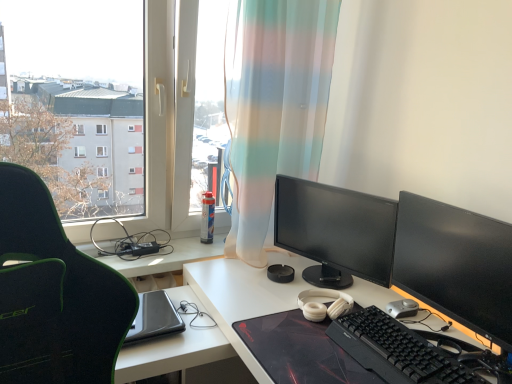
Measure the distance between black plastic keyboard at lower right and camera.

black plastic keyboard at lower right is 98.60 centimeters away from camera.

The width and height of the screenshot is (512, 384). Describe the element at coordinates (94, 103) in the screenshot. I see `transparent plastic window at upper left` at that location.

What is the approximate height of transparent plastic window at upper left?

34.05 inches.

What do you see at coordinates (243, 296) in the screenshot?
I see `white matte desk at center` at bounding box center [243, 296].

In order to click on matte black monitor at center, positioned as the 2th computer monitor in front-to-back order in this screenshot , I will do `click(336, 227)`.

This screenshot has width=512, height=384. Describe the element at coordinates (336, 227) in the screenshot. I see `matte black monitor at center, positioned as the 2th computer monitor in front-to-back order` at that location.

Locate an element on the screen. This screenshot has height=384, width=512. silver metallic mouse at lower right is located at coordinates (402, 308).

Image resolution: width=512 pixels, height=384 pixels. Find the location of `black plastic keyboard at lower right`. black plastic keyboard at lower right is located at coordinates (396, 350).

From a real-world perspective, is white matte desk at center above or below matte black monitor at center, which ranks as the 1th computer monitor in back-to-front order?

white matte desk at center is situated lower than matte black monitor at center, which ranks as the 1th computer monitor in back-to-front order, in the real world.

Can you confirm if white matte desk at center is wider than matte black monitor at center, positioned as the 2th computer monitor in front-to-back order?

Yes, white matte desk at center is wider than matte black monitor at center, positioned as the 2th computer monitor in front-to-back order.

Based on the photo, from the image's perspective, between white matte desk at center and matte black monitor at center, which ranks as the 1th computer monitor in back-to-front order, who is located below?

white matte desk at center is shown below in the image.

From the image's perspective, which computer monitor is the 2nd one above the white matte desk at center? Please provide its 2D coordinates.

[(336, 227)]

Is matte black monitor at center, which ranks as the 1th computer monitor in back-to-front order, inside silver metallic mouse at lower right?

Definitely not — matte black monitor at center, which ranks as the 1th computer monitor in back-to-front order, is not inside silver metallic mouse at lower right.

From a real-world perspective, who is located lower, silver metallic mouse at lower right or matte black monitor at center, positioned as the 2th computer monitor in front-to-back order?

From a 3D spatial view, silver metallic mouse at lower right is below.

Measure the distance between translucent fabric curtain at center and black textured mousepad at center.

They are 25.40 inches apart.

Could you tell me if translucent fabric curtain at center is facing black textured mousepad at center?

Yes, translucent fabric curtain at center faces towards black textured mousepad at center.

Based on the photo, are translucent fabric curtain at center and black textured mousepad at center located far from each other?

No.

From a real-world perspective, is translucent fabric curtain at center positioned under black textured mousepad at center based on gravity?

Incorrect, from a real-world perspective, translucent fabric curtain at center is higher than black textured mousepad at center.

Can you confirm if translucent fabric curtain at center is wider than matte black monitor at center, positioned as the 2th computer monitor in front-to-back order?

Indeed, translucent fabric curtain at center has a greater width compared to matte black monitor at center, positioned as the 2th computer monitor in front-to-back order.

Can you confirm if translucent fabric curtain at center is shorter than matte black monitor at center, which ranks as the 1th computer monitor in back-to-front order?

Incorrect, the height of translucent fabric curtain at center does not fall short of that of matte black monitor at center, which ranks as the 1th computer monitor in back-to-front order.

In the scene shown: From the image's perspective, is translucent fabric curtain at center beneath matte black monitor at center, which ranks as the 1th computer monitor in back-to-front order?

Incorrect, from the image's perspective, translucent fabric curtain at center is higher than matte black monitor at center, which ranks as the 1th computer monitor in back-to-front order.

Is translucent fabric curtain at center to the left of matte black monitor at center, which ranks as the 1th computer monitor in back-to-front order, from the viewer's perspective?

Correct, you'll find translucent fabric curtain at center to the left of matte black monitor at center, which ranks as the 1th computer monitor in back-to-front order.

Which of these two, black textured mousepad at center or white matte desk at center, is smaller?

black textured mousepad at center.

From the image's perspective, is black textured mousepad at center located above white matte desk at center?

Indeed, from the image's perspective, black textured mousepad at center is shown above white matte desk at center.

Would you say black textured mousepad at center is to the left or to the right of white matte desk at center in the picture?

From the image, it's evident that black textured mousepad at center is to the right of white matte desk at center.

How much distance is there between black textured mousepad at center and white matte desk at center?

black textured mousepad at center is 6.06 inches from white matte desk at center.

How much distance is there between black glossy monitor at right, the first computer monitor in the front-to-back sequence, and translucent fabric curtain at center?

black glossy monitor at right, the first computer monitor in the front-to-back sequence, and translucent fabric curtain at center are 25.36 inches apart.

Is black glossy monitor at right, the first computer monitor in the front-to-back sequence, inside or outside of translucent fabric curtain at center?

black glossy monitor at right, the first computer monitor in the front-to-back sequence, cannot be found inside translucent fabric curtain at center.

Is black glossy monitor at right, the first computer monitor in the front-to-back sequence, next to translucent fabric curtain at center and touching it?

They are not placed beside each other.

Can you tell me how much black glossy monitor at right, the second computer monitor viewed from the back, and translucent fabric curtain at center differ in facing direction?

black glossy monitor at right, the second computer monitor viewed from the back, and translucent fabric curtain at center are facing 90.9 degrees away from each other.

Is white matte headphones at center located within translucent fabric curtain at center?

No, white matte headphones at center is not inside translucent fabric curtain at center.

Is translucent fabric curtain at center bigger than white matte headphones at center?

Correct, translucent fabric curtain at center is larger in size than white matte headphones at center.

From the image's perspective, between translucent fabric curtain at center and white matte headphones at center, which one is located above?

translucent fabric curtain at center.

Considering the positions of points (269, 98) and (303, 303), is point (269, 98) closer to camera compared to point (303, 303)?

That is False.

Identify the location of the 1st computer monitor above the white matte desk at center (from a real-world perspective). (336, 227).

This screenshot has height=384, width=512. In order to click on mouse below the matte black monitor at center, positioned as the 2th computer monitor in front-to-back order (from the image's perspective) in this screenshot , I will do click(402, 308).

Estimate the real-world distances between objects in this image. Which object is further from transparent plastic window at upper left, white matte desk at center or black textured mousepad at center?

black textured mousepad at center is further to transparent plastic window at upper left.

When comparing their distances from white matte desk at center, does black plastic keyboard at lower right or translucent fabric curtain at center seem further?

translucent fabric curtain at center is further to white matte desk at center.

Estimate the real-world distances between objects in this image. Which object is closer to black textured mousepad at center, transparent plastic window at upper left or silver metallic mouse at lower right?

Among the two, silver metallic mouse at lower right is located nearer to black textured mousepad at center.

Which object lies nearer to the anchor point black glossy monitor at right, the first computer monitor in the front-to-back sequence, black plastic keyboard at lower right or matte black monitor at center, which ranks as the 1th computer monitor in back-to-front order?

The object closer to black glossy monitor at right, the first computer monitor in the front-to-back sequence, is black plastic keyboard at lower right.

Which object lies further to the anchor point black glossy monitor at right, the second computer monitor viewed from the back, white matte desk at center or transparent plastic window at upper left?

transparent plastic window at upper left.

Estimate the real-world distances between objects in this image. Which object is further from white matte headphones at center, translucent fabric curtain at center or silver metallic mouse at lower right?

translucent fabric curtain at center lies further to white matte headphones at center than the other object.

Looking at the image, which one is located further to silver metallic mouse at lower right, black textured mousepad at center or black plastic keyboard at lower right?

black textured mousepad at center.

Considering their positions, is black textured mousepad at center positioned closer to black glossy monitor at right, the first computer monitor in the front-to-back sequence, than silver metallic mouse at lower right?

Among the two, silver metallic mouse at lower right is located nearer to black glossy monitor at right, the first computer monitor in the front-to-back sequence.

This screenshot has width=512, height=384. Find the location of `headphones between black textured mousepad at center and silver metallic mouse at lower right in the front-back direction`. headphones between black textured mousepad at center and silver metallic mouse at lower right in the front-back direction is located at coordinates (324, 305).

You are a GUI agent. You are given a task and a screenshot of the screen. Output one action in this format:
    pyautogui.click(x=<x>, y=<y>)
    Task: Click on the mousepad between translucent fabric curtain at center and white matte desk at center in the up-down direction
    Image resolution: width=512 pixels, height=384 pixels.
    Given the screenshot: What is the action you would take?
    pyautogui.click(x=300, y=351)

The image size is (512, 384). I want to click on computer monitor between translucent fabric curtain at center and black glossy monitor at right, the second computer monitor viewed from the back, so click(x=336, y=227).

Locate an element on the screen. The width and height of the screenshot is (512, 384). headphones between translucent fabric curtain at center and black plastic keyboard at lower right in the up-down direction is located at coordinates (324, 305).